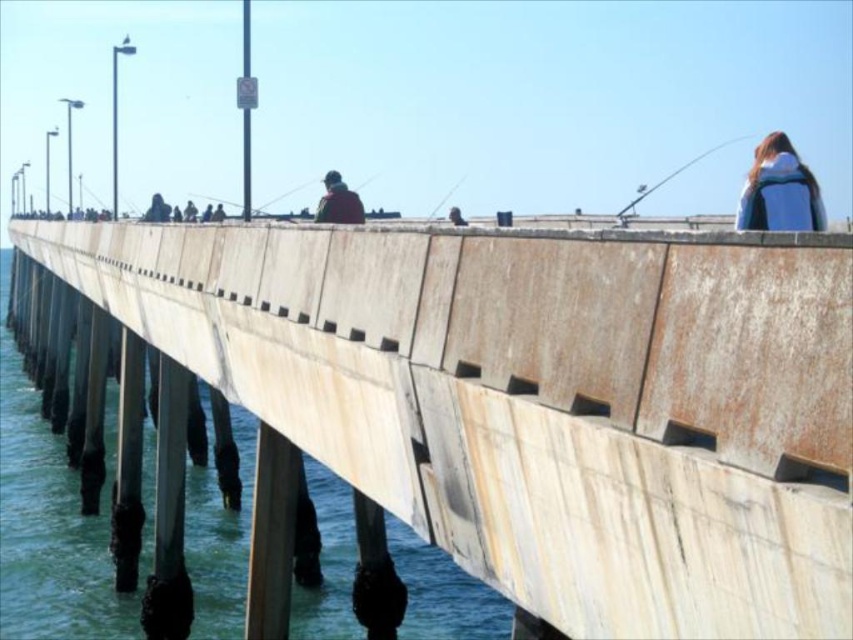
You are standing on the pier and see both the blue backpack at upper right and the matte black fishing pole at upper right. Which object is closer to the edge of the pier?

The blue backpack at upper right is positioned on the left side of matte black fishing pole at upper right, so the blue backpack at upper right is closer to the edge of the pier.